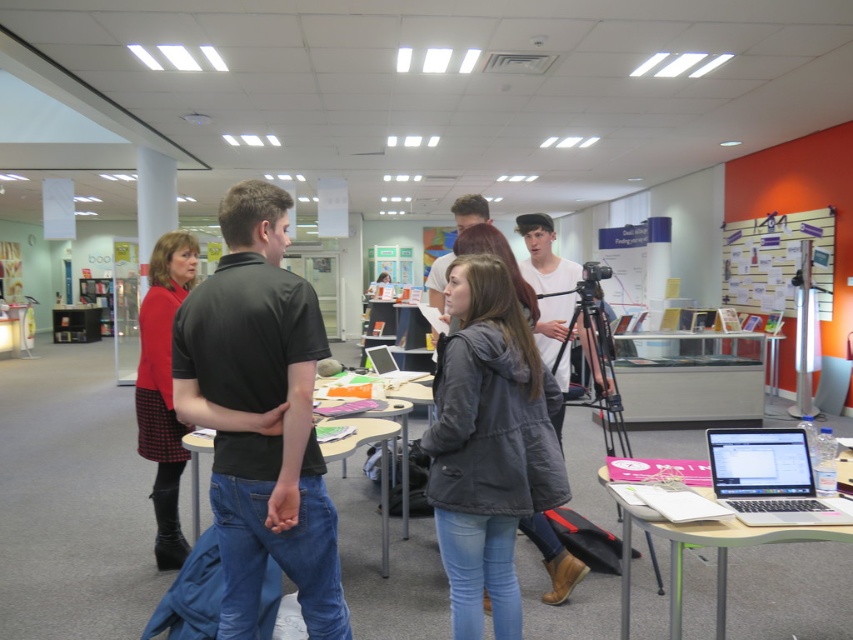
You are standing at the entrance of the library and want to find the metallic silver table at center. According to the coordinates provided, in which direction should you walk to reach it?

The metallic silver table at center is located at coordinates point (689,380). Since the coordinate system typically places the origin at the bottom left corner, you should walk towards the upper right direction to reach it.

You are a photographer standing at the entrance of the room. You want to take a photo of both the red knit sweater at left and the silver metallic tablet at center. Which object will appear larger in the photo?

The red knit sweater at left will appear larger in the photo because it is closer to the viewer than the silver metallic tablet at center.

You are standing at the entrance of the room and want to locate the silver metallic laptop at lower right. According to the coordinates provided, where should you look relative to the entrance?

The silver metallic laptop at lower right is located at coordinates point (769, 477), which is towards the lower right corner of the room from the entrance.